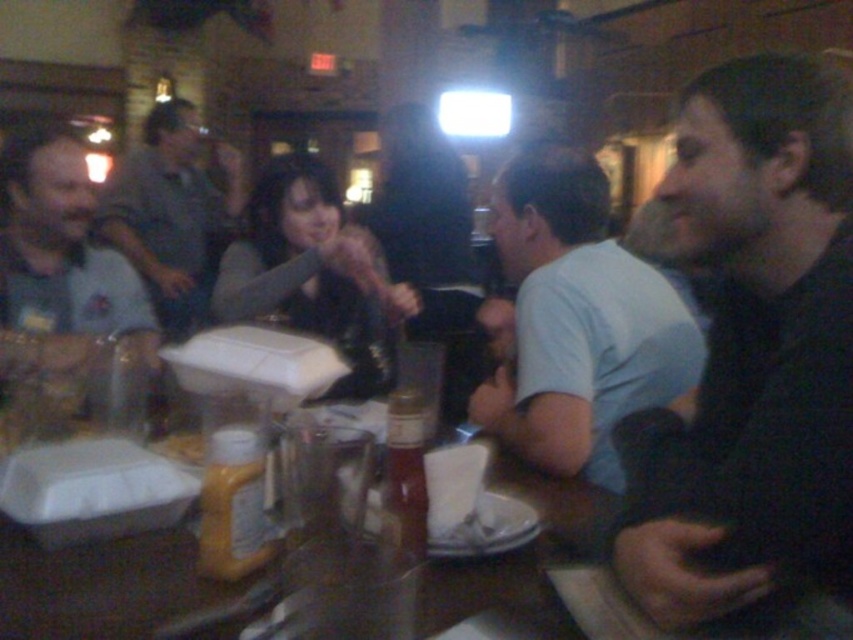
Which is more to the right, gray shirt at upper left or yellow plastic mustard bottle at center?

From the viewer's perspective, yellow plastic mustard bottle at center appears more on the right side.

This screenshot has height=640, width=853. I want to click on gray shirt at upper left, so click(x=172, y=214).

Does matte gray shirt at left appear on the right side of translucent plastic bottle at center?

Incorrect, matte gray shirt at left is not on the right side of translucent plastic bottle at center.

Is matte gray shirt at left shorter than translucent plastic bottle at center?

Incorrect, matte gray shirt at left's height does not fall short of translucent plastic bottle at center's.

Who is more distant from viewer, (x=90, y=348) or (x=422, y=436)?

Point (x=90, y=348)

Identify the location of matte gray shirt at left. (62, 259).

Consider the image. Who is taller, wooden table at center or translucent plastic bottle at center?

translucent plastic bottle at center is taller.

Does point (148, 605) lie in front of point (418, 420)?

Yes.

At what (x,y) coordinates should I click in order to perform the action: click on wooden table at center. Please return your answer as a coordinate pair (x, y). This screenshot has width=853, height=640. Looking at the image, I should click on (109, 589).